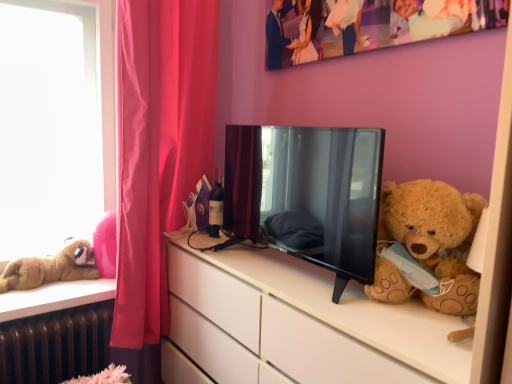
Locate an element on the screen. free space in front of fluffy brown teddy bear at right, which is the first teddy bear in right-to-left order is located at coordinates (418, 336).